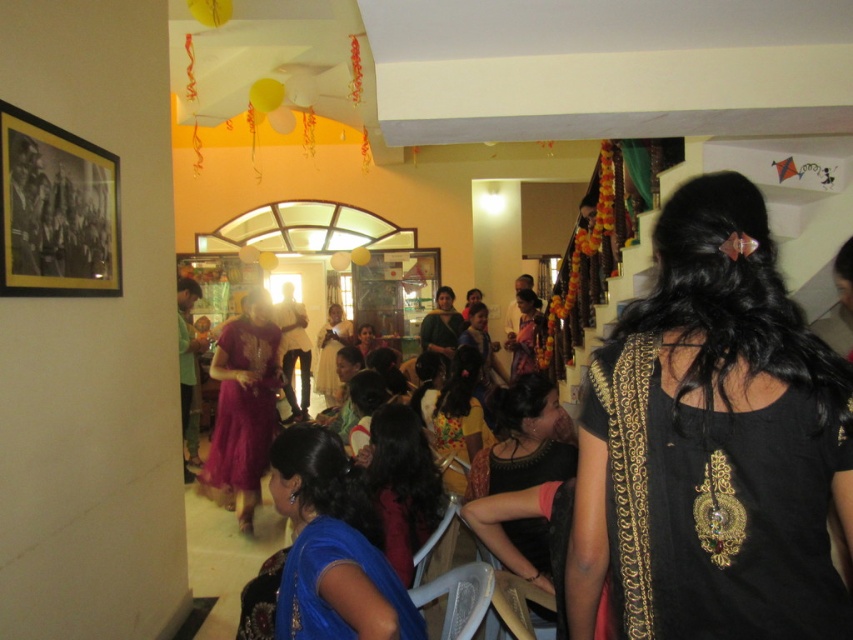
You are a photographer at the event and want to capture a photo of both the shiny magenta dress at center and the black satin blouse at center. Since the camera has a limited focus area, which garment should you position closer to the center of the frame to ensure both are fully visible?

The shiny magenta dress at center has a larger width than the black satin blouse at center, so positioning the shiny magenta dress at center closer to the center of the frame will allow both garments to fit within the camera focus area.

You are attending a cultural event and notice two outfits at the center of the room. The shiny magenta dress at center and the black satin blouse at center. Which outfit is taller?

The shiny magenta dress at center is taller than the black satin blouse at center.

You are a photographer at the event and want to capture a photo of the black embroidered blouse at center and the matte pink saree at center. Which one is positioned higher in the image?

The black embroidered blouse at center is located above the matte pink saree at center, so it is positioned higher in the image.